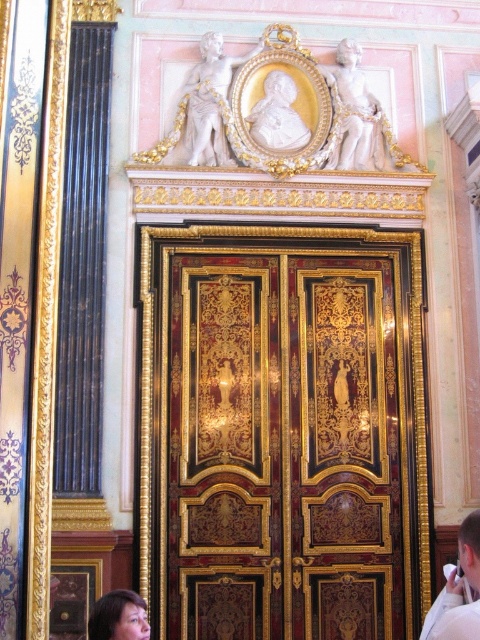
Between point (468, 577) and point (91, 634), which one is positioned in front?

Point (468, 577) is more forward.

Which of these two, white matte shirt at lower right or smooth skin face at lower left, stands taller?

white matte shirt at lower right is taller.

The image size is (480, 640). I want to click on white matte shirt at lower right, so click(458, 589).

At what (x,y) coordinates should I click in order to perform the action: click on white matte shirt at lower right. Please return your answer as a coordinate pair (x, y). This screenshot has width=480, height=640. Looking at the image, I should click on [458, 589].

Can you confirm if glossy wood door at center is smaller than white matte shirt at lower right?

No, glossy wood door at center is not smaller than white matte shirt at lower right.

The height and width of the screenshot is (640, 480). In order to click on glossy wood door at center in this screenshot , I will do (x=283, y=433).

Is white matte shirt at lower right shorter than white satin robe at center?

No.

Who is higher up, white matte shirt at lower right or white satin robe at center?

Positioned higher is white satin robe at center.

Between point (470, 541) and point (429, 637), which one is positioned behind?

Positioned behind is point (470, 541).

What are the coordinates of `white matte shirt at lower right` in the screenshot? It's located at (458, 589).